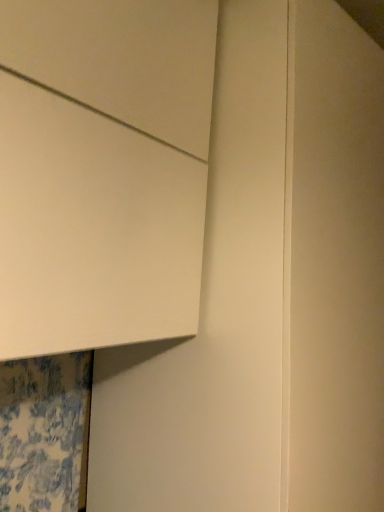
Describe the element at coordinates (102, 170) in the screenshot. I see `white matte cabinet at upper left` at that location.

Identify the location of white matte cabinet at upper left. (102, 170).

Image resolution: width=384 pixels, height=512 pixels. Describe the element at coordinates (213, 314) in the screenshot. I see `matte white door at upper left` at that location.

Where is `matte white door at upper left`? matte white door at upper left is located at coordinates (213, 314).

Identify the location of white matte cabinet at upper left. (102, 170).

Consider the image. Is matte white door at upper left to the left of white matte cabinet at upper left from the viewer's perspective?

No.

Which object is closer to the camera, matte white door at upper left or white matte cabinet at upper left?

white matte cabinet at upper left is in front.

Does point (256, 170) appear closer or farther from the camera than point (48, 4)?

Point (256, 170) is positioned farther from the camera compared to point (48, 4).

From the image's perspective, is matte white door at upper left positioned above or below white matte cabinet at upper left?

From the image's perspective, matte white door at upper left appears below white matte cabinet at upper left.

From a real-world perspective, who is located lower, matte white door at upper left or white matte cabinet at upper left?

matte white door at upper left, from a real-world perspective.

Based on the photo, considering the relative sizes of matte white door at upper left and white matte cabinet at upper left in the image provided, is matte white door at upper left wider than white matte cabinet at upper left?

Indeed, matte white door at upper left has a greater width compared to white matte cabinet at upper left.

Between matte white door at upper left and white matte cabinet at upper left, which one has less height?

With less height is white matte cabinet at upper left.

Who is smaller, matte white door at upper left or white matte cabinet at upper left?

white matte cabinet at upper left.

Would you say matte white door at upper left is outside white matte cabinet at upper left?

matte white door at upper left is positioned outside white matte cabinet at upper left.

Is matte white door at upper left not near white matte cabinet at upper left?

No, there isn't a large distance between matte white door at upper left and white matte cabinet at upper left.

Is matte white door at upper left oriented away from white matte cabinet at upper left?

No, matte white door at upper left's orientation is not away from white matte cabinet at upper left.

How different are the orientations of matte white door at upper left and white matte cabinet at upper left in degrees?

4.93e-05 degrees.

How distant is matte white door at upper left from white matte cabinet at upper left?

The distance of matte white door at upper left from white matte cabinet at upper left is 10.47 inches.

Where is `cabinetry that is above the matte white door at upper left (from the image's perspective)`? This screenshot has width=384, height=512. cabinetry that is above the matte white door at upper left (from the image's perspective) is located at coordinates (102, 170).

Is white matte cabinet at upper left at the right side of matte white door at upper left?

Incorrect, white matte cabinet at upper left is not on the right side of matte white door at upper left.

In the image, is white matte cabinet at upper left positioned in front of or behind matte white door at upper left?

Visually, white matte cabinet at upper left is located in front of matte white door at upper left.

Considering the points (129, 125) and (254, 20), which point is behind, point (129, 125) or point (254, 20)?

The point (254, 20) is behind.

From the image's perspective, relative to matte white door at upper left, is white matte cabinet at upper left above or below?

From the image's perspective, white matte cabinet at upper left appears above matte white door at upper left.

From a real-world perspective, is white matte cabinet at upper left positioned over matte white door at upper left based on gravity?

Correct, in the physical world, white matte cabinet at upper left is higher than matte white door at upper left.

Consider the image. Considering the sizes of white matte cabinet at upper left and matte white door at upper left in the image, is white matte cabinet at upper left wider or thinner than matte white door at upper left?

Clearly, white matte cabinet at upper left has less width compared to matte white door at upper left.

Considering the relative sizes of white matte cabinet at upper left and matte white door at upper left in the image provided, is white matte cabinet at upper left shorter than matte white door at upper left?

Yes.

Consider the image. Between white matte cabinet at upper left and matte white door at upper left, which one has larger size?

With larger size is matte white door at upper left.

Consider the image. Would you say white matte cabinet at upper left is inside or outside matte white door at upper left?

white matte cabinet at upper left is not enclosed by matte white door at upper left.

Is white matte cabinet at upper left beside matte white door at upper left?

No, white matte cabinet at upper left is not touching matte white door at upper left.

Could you tell me if white matte cabinet at upper left is turned towards matte white door at upper left?

No, white matte cabinet at upper left is not turned towards matte white door at upper left.

What's the angular difference between white matte cabinet at upper left and matte white door at upper left's facing directions?

They differ by 4.93e-05 degrees in their facing directions.

Where is `cabinetry above the matte white door at upper left (from a real-world perspective)`? This screenshot has height=512, width=384. cabinetry above the matte white door at upper left (from a real-world perspective) is located at coordinates (102, 170).

The height and width of the screenshot is (512, 384). In order to click on door that is below the white matte cabinet at upper left (from the image's perspective) in this screenshot , I will do coord(213,314).

Identify the location of cabinetry on the left side of matte white door at upper left. This screenshot has height=512, width=384. (102, 170).